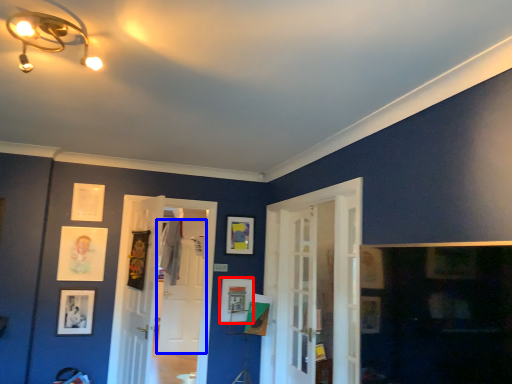
Question: Which of the following is the farthest to the observer, picture frame (highlighted by a red box) or door (highlighted by a blue box)?

Choices:
 (A) picture frame
 (B) door

Answer: (B)